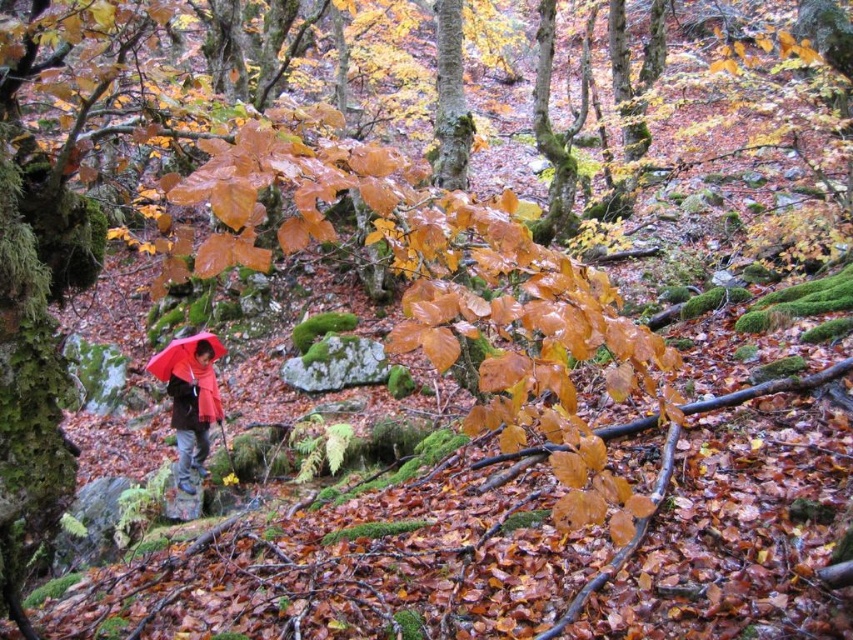
Question: Can you confirm if red matte jacket at center is thinner than matte red umbrella at center?

Choices:
 (A) yes
 (B) no

Answer: (A)

Question: Which point is farther to the camera?

Choices:
 (A) (178, 344)
 (B) (189, 369)

Answer: (A)

Question: From the image, what is the correct spatial relationship of red matte jacket at center in relation to matte red umbrella at center?

Choices:
 (A) below
 (B) above

Answer: (A)

Question: From the image, what is the correct spatial relationship of red matte jacket at center in relation to matte red umbrella at center?

Choices:
 (A) below
 (B) above

Answer: (A)

Question: Which of the following is the farthest from the observer?

Choices:
 (A) matte red umbrella at center
 (B) red matte jacket at center

Answer: (A)